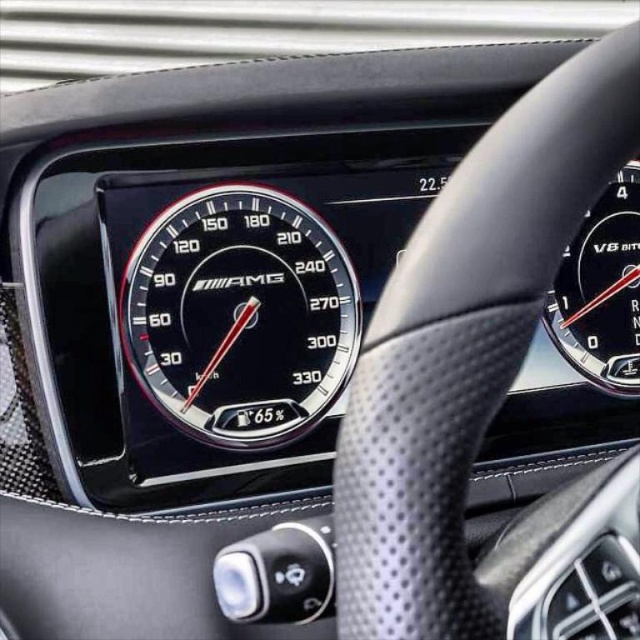
You are a driver checking the dashboard of a high performance car. You see the black glossy speedometer at center and the black glossy speedometer at upper right. Which one is larger in size?

The black glossy speedometer at center is bigger than the black glossy speedometer at upper right.

Consider the image. You are a driver checking your vehicle dashboard. You notice the black leather steering wheel at center and the black glossy speedometer at center. Which object is wider?

The black leather steering wheel at center is wider than the black glossy speedometer at center.

Looking at this image, you are sitting in the driver seat of the car and want to check the speedometer. Where is the black leather steering wheel at center located relative to the speedometer?

The black leather steering wheel at center is located to the right of the speedometer.